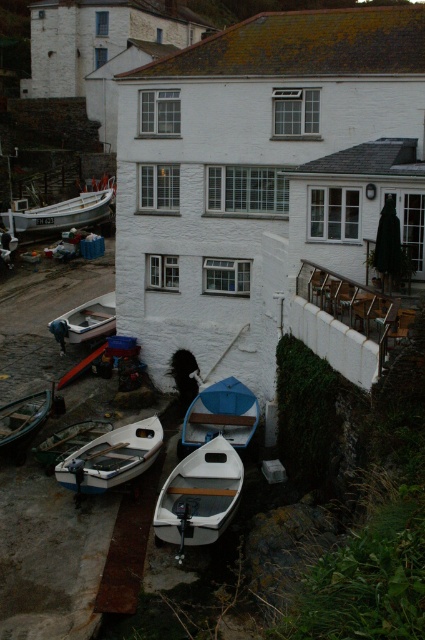
You are a tourist standing on the dock and want to board the blue matte boat at center and the white wooden boat at center. Which boat should you approach first if you want to start from the left side of the dock?

You should approach the white wooden boat at center first because the blue matte boat at center is positioned on the right side of it.

You are standing at the point labeled point (82, 333) and want to walk to the point labeled point (251, 412). Given the coastal scene described, which direction should you face to move towards your destination?

You should face forward because point (251, 412) is in front of point (82, 333).